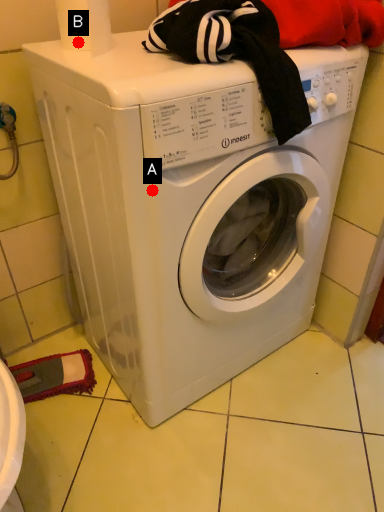
Question: Two points are circled on the image, labeled by A and B beside each circle. Which of the following is the closest to the observer?

Choices:
 (A) A is closer
 (B) B is closer

Answer: (A)